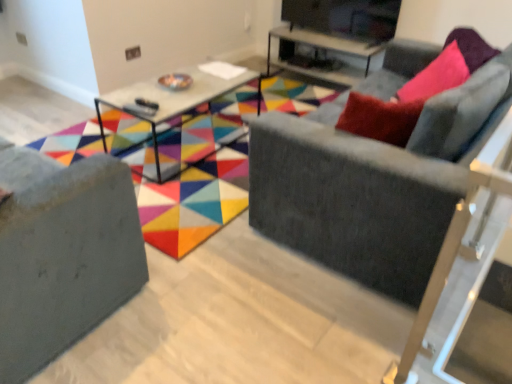
What do you see at coordinates (187, 171) in the screenshot? I see `matte gray sofa at center` at bounding box center [187, 171].

Find the location of a particular element. velvet grey couch at lower left, the first studio couch in the left-to-right sequence is located at coordinates (62, 253).

You are a GUI agent. You are given a task and a screenshot of the screen. Output one action in this format:
    pyautogui.click(x=<x>, y=<y>)
    Task: Click on the velvet gray couch at right, the 2th studio couch when ordered from left to right
    The height and width of the screenshot is (384, 512).
    Given the screenshot: What is the action you would take?
    pyautogui.click(x=373, y=183)

The width and height of the screenshot is (512, 384). What are the coordinates of `metallic glass table at upper center, which is the second table in left-to-right order` in the screenshot? It's located at coord(326,50).

Considering the relative sizes of metallic glass table at upper center, which appears as the first table when viewed from the right, and matte black tv stand at upper center in the image provided, is metallic glass table at upper center, which appears as the first table when viewed from the right, smaller than matte black tv stand at upper center?

No, metallic glass table at upper center, which appears as the first table when viewed from the right, is not smaller than matte black tv stand at upper center.

Which is in front, point (345, 72) or point (358, 18)?

The point (358, 18) is more forward.

Is metallic glass table at upper center, which is the second table in left-to-right order, far from matte black tv stand at upper center?

No.

From the image's perspective, is metallic glass table at upper center, which appears as the first table when viewed from the right, positioned above or below velvet gray couch at right, the 2th studio couch when ordered from left to right?

Based on their image positions, metallic glass table at upper center, which appears as the first table when viewed from the right, is located above velvet gray couch at right, the 2th studio couch when ordered from left to right.

From the image's perspective, starting from the metallic glass table at upper center, which appears as the first table when viewed from the right, which studio couch is the 1st one below? Please provide its 2D coordinates.

[(373, 183)]

Which object is further away from the camera, metallic glass table at upper center, which appears as the first table when viewed from the right, or velvet gray couch at right, marked as the first studio couch in a right-to-left arrangement?

metallic glass table at upper center, which appears as the first table when viewed from the right, is more distant.

Locate an element on the screen. The width and height of the screenshot is (512, 384). pattern lying behind the velvet grey couch at lower left, positioned as the 2th studio couch in right-to-left order is located at coordinates (187, 171).

From a real-world perspective, which is physically above, velvet grey couch at lower left, positioned as the 2th studio couch in right-to-left order, or matte gray sofa at center?

In real-world perspective, velvet grey couch at lower left, positioned as the 2th studio couch in right-to-left order, is above.

Visually, is velvet grey couch at lower left, the first studio couch in the left-to-right sequence, positioned to the left or to the right of matte gray sofa at center?

In the image, velvet grey couch at lower left, the first studio couch in the left-to-right sequence, appears on the left side of matte gray sofa at center.

Is velvet grey couch at lower left, positioned as the 2th studio couch in right-to-left order, looking in the opposite direction of matte gray sofa at center?

velvet grey couch at lower left, positioned as the 2th studio couch in right-to-left order, is not turned away from matte gray sofa at center.

How far apart are matte glass table at center, which is the 1th table from left to right, and matte black tv stand at upper center?

matte glass table at center, which is the 1th table from left to right, is 4.97 feet from matte black tv stand at upper center.

Considering the sizes of objects matte glass table at center, which is counted as the 2th table, starting from the right, and matte black tv stand at upper center in the image provided, who is taller, matte glass table at center, which is counted as the 2th table, starting from the right, or matte black tv stand at upper center?

matte glass table at center, which is counted as the 2th table, starting from the right.

From a real-world perspective, between matte glass table at center, which is the 1th table from left to right, and matte black tv stand at upper center, who is vertically higher?

matte black tv stand at upper center.

Is matte glass table at center, which is the 1th table from left to right, directly adjacent to matte black tv stand at upper center?

There is a gap between matte glass table at center, which is the 1th table from left to right, and matte black tv stand at upper center.

Is metallic glass table at upper center, the second table viewed from the front, in front of or behind matte gray sofa at center in the image?

Clearly, metallic glass table at upper center, the second table viewed from the front, is behind matte gray sofa at center.

Between metallic glass table at upper center, which appears as the first table when viewed from the right, and matte gray sofa at center, which one appears on the left side from the viewer's perspective?

Positioned to the left is matte gray sofa at center.

Are metallic glass table at upper center, which is the second table in left-to-right order, and matte gray sofa at center located far from each other?

metallic glass table at upper center, which is the second table in left-to-right order, is near matte gray sofa at center, not far away.

Between metallic glass table at upper center, which is the second table in left-to-right order, and matte gray sofa at center, which one has larger width?

With larger width is matte gray sofa at center.

Can you confirm if metallic glass table at upper center, which appears as the 1th table when viewed from the back, is positioned to the left of velvet grey couch at lower left, the first studio couch in the left-to-right sequence?

Incorrect, metallic glass table at upper center, which appears as the 1th table when viewed from the back, is not on the left side of velvet grey couch at lower left, the first studio couch in the left-to-right sequence.

How many degrees apart are the facing directions of metallic glass table at upper center, which appears as the first table when viewed from the right, and velvet grey couch at lower left, positioned as the 2th studio couch in right-to-left order?

177 degrees.

From the image's perspective, is metallic glass table at upper center, which appears as the first table when viewed from the right, positioned above or below velvet grey couch at lower left, the first studio couch in the left-to-right sequence?

From the image's perspective, metallic glass table at upper center, which appears as the first table when viewed from the right, appears above velvet grey couch at lower left, the first studio couch in the left-to-right sequence.

From a real-world perspective, is metallic glass table at upper center, which appears as the first table when viewed from the right, positioned above or below velvet grey couch at lower left, the first studio couch in the left-to-right sequence?

Clearly, from a real-world perspective, metallic glass table at upper center, which appears as the first table when viewed from the right, is below velvet grey couch at lower left, the first studio couch in the left-to-right sequence.

What's the angular difference between matte gray sofa at center and matte glass table at center, which is counted as the 2th table, starting from the right,'s facing directions?

The angle between the facing direction of matte gray sofa at center and the facing direction of matte glass table at center, which is counted as the 2th table, starting from the right, is 1.4 degrees.

Considering the sizes of objects matte gray sofa at center and matte glass table at center, which is counted as the 2th table, starting from the right, in the image provided, who is smaller, matte gray sofa at center or matte glass table at center, which is counted as the 2th table, starting from the right,?

matte glass table at center, which is counted as the 2th table, starting from the right, is smaller.

Considering the positions of objects matte gray sofa at center and matte glass table at center, which appears as the 2th table when viewed from the back, in the image provided, who is behind, matte gray sofa at center or matte glass table at center, which appears as the 2th table when viewed from the back,?

matte glass table at center, which appears as the 2th table when viewed from the back, is further away from the camera.

Are matte gray sofa at center and matte glass table at center, which is the 1th table from left to right, beside each other?

No.

What are the coordinates of `the 1st table counting from the left of the matte black tv stand at upper center` in the screenshot? It's located at (326, 50).

Locate an element on the screen. the 2nd table behind the velvet gray couch at right, marked as the first studio couch in a right-to-left arrangement is located at coordinates (326, 50).

When comparing their distances from metallic glass table at upper center, which is the second table in left-to-right order, does matte black tv stand at upper center or velvet grey couch at lower left, positioned as the 2th studio couch in right-to-left order, seem closer?

matte black tv stand at upper center is positioned closer to the anchor metallic glass table at upper center, which is the second table in left-to-right order.

Looking at the image, which one is located closer to velvet gray couch at right, marked as the first studio couch in a right-to-left arrangement, matte black tv stand at upper center or matte gray sofa at center?

Based on the image, matte gray sofa at center appears to be nearer to velvet gray couch at right, marked as the first studio couch in a right-to-left arrangement.

Considering their positions, is velvet gray couch at right, marked as the first studio couch in a right-to-left arrangement, positioned closer to metallic glass table at upper center, which appears as the first table when viewed from the right, than velvet grey couch at lower left, the first studio couch in the left-to-right sequence?

velvet gray couch at right, marked as the first studio couch in a right-to-left arrangement.

From the image, which object appears to be nearer to matte black tv stand at upper center, velvet gray couch at right, the 2th studio couch when ordered from left to right, or velvet grey couch at lower left, positioned as the 2th studio couch in right-to-left order?

velvet gray couch at right, the 2th studio couch when ordered from left to right.

From the image, which object appears to be nearer to velvet gray couch at right, marked as the first studio couch in a right-to-left arrangement, matte glass table at center, which is the 1th table from left to right, or matte black tv stand at upper center?

matte glass table at center, which is the 1th table from left to right, is closer to velvet gray couch at right, marked as the first studio couch in a right-to-left arrangement.

When comparing their distances from matte gray sofa at center, does velvet gray couch at right, the 2th studio couch when ordered from left to right, or matte black tv stand at upper center seem closer?

velvet gray couch at right, the 2th studio couch when ordered from left to right.

Looking at the image, which one is located closer to metallic glass table at upper center, which appears as the 1th table when viewed from the back, matte black tv stand at upper center or matte gray sofa at center?

matte black tv stand at upper center is positioned closer to the anchor metallic glass table at upper center, which appears as the 1th table when viewed from the back.

Looking at the image, which one is located further to matte black tv stand at upper center, metallic glass table at upper center, which appears as the 1th table when viewed from the back, or matte gray sofa at center?

Among the two, matte gray sofa at center is located further to matte black tv stand at upper center.

Identify the location of table located between matte gray sofa at center and metallic glass table at upper center, the second table viewed from the front, in the depth direction. click(170, 99).

You are a GUI agent. You are given a task and a screenshot of the screen. Output one action in this format:
    pyautogui.click(x=<x>, y=<y>)
    Task: Click on the pattern between matte glass table at center, the 1th table in the front-to-back sequence, and velvet gray couch at right, the 2th studio couch when ordered from left to right, in the horizontal direction
    The height and width of the screenshot is (384, 512).
    Given the screenshot: What is the action you would take?
    point(187,171)

At what (x,y) coordinates should I click in order to perform the action: click on entertainment center between matte gray sofa at center and metallic glass table at upper center, which is the second table in left-to-right order, along the z-axis. Please return your answer as a coordinate pair (x, y). Image resolution: width=512 pixels, height=384 pixels. Looking at the image, I should click on (345, 17).

At what (x,y) coordinates should I click in order to perform the action: click on table between velvet gray couch at right, the 2th studio couch when ordered from left to right, and matte black tv stand at upper center from front to back. Please return your answer as a coordinate pair (x, y). Looking at the image, I should click on (170, 99).